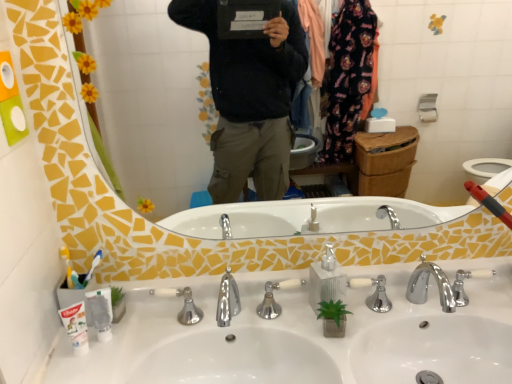
Question: Based on their positions, is yellow mosaic mirror at upper center located to the left or right of polished chrome faucet at center?

Choices:
 (A) left
 (B) right

Answer: (B)

Question: Is yellow mosaic mirror at upper center situated inside polished chrome faucet at center or outside?

Choices:
 (A) outside
 (B) inside

Answer: (A)

Question: Which of these objects is positioned closest to the white plastic toothbrush at left?

Choices:
 (A) white matte toothpaste at lower left
 (B) polished chrome faucet at center
 (C) yellow mosaic mirror at upper center
 (D) silver metallic soap dispenser at center
 (E) white plastic toothbrush at left

Answer: (A)

Question: Which object is the farthest from the yellow mosaic mirror at upper center?

Choices:
 (A) white plastic toothbrush at left
 (B) white plastic toothbrush at left
 (C) white matte toothpaste at lower left
 (D) polished chrome faucet at center
 (E) silver metallic soap dispenser at center

Answer: (C)